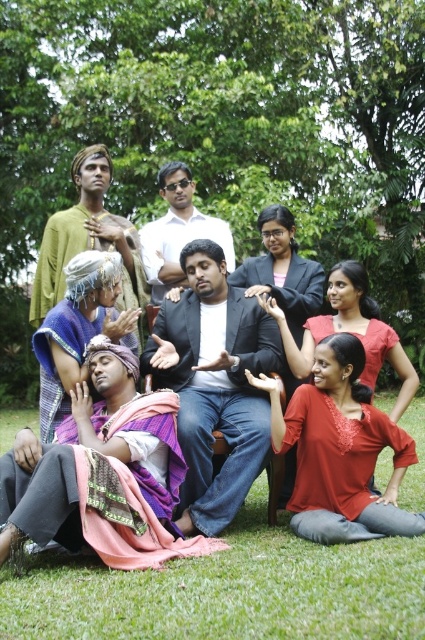
How far apart are green grass at lower center and white glossy shirt at center?

The distance of green grass at lower center from white glossy shirt at center is 8.97 meters.

At what (x,y) coordinates should I click in order to perform the action: click on green grass at lower center. Please return your answer as a coordinate pair (x, y). Looking at the image, I should click on (227, 589).

Does point (359, 620) come in front of point (187, 225)?

Yes, it is.

Where is `green grass at lower center`? green grass at lower center is located at coordinates (227, 589).

I want to click on green grass at lower center, so [227, 589].

Which is above, green grass at lower center or matte black suit at center?

Positioned higher is matte black suit at center.

I want to click on green grass at lower center, so click(227, 589).

Which is above, dark gray suit at center or matte black suit at center?

matte black suit at center is higher up.

Can you confirm if dark gray suit at center is positioned to the right of matte black suit at center?

Correct, you'll find dark gray suit at center to the right of matte black suit at center.

Which is in front, point (170, 332) or point (192, 284)?

Positioned in front is point (170, 332).

Where is `dark gray suit at center`? The image size is (425, 640). dark gray suit at center is located at coordinates (214, 385).